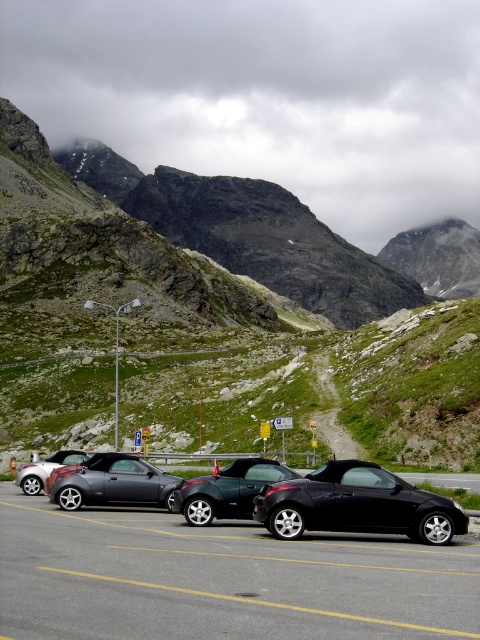
Question: Which is farther from the shiny black convertible at center?

Choices:
 (A) black matte convertible at center
 (B) black glossy car at center
 (C) metallic gray car at center
 (D) metallic gray convertible at center

Answer: (C)

Question: Does metallic gray car at center appear over metallic silver convertible at center?

Choices:
 (A) no
 (B) yes

Answer: (B)

Question: Can you confirm if metallic gray car at center is positioned above rugged granite mountain at upper center?

Choices:
 (A) yes
 (B) no

Answer: (B)

Question: Does black matte convertible at center appear on the right side of green grassy slope at center?

Choices:
 (A) no
 (B) yes

Answer: (A)

Question: Which point appears farthest from the camera in this image?

Choices:
 (A) (383, 500)
 (B) (412, 276)
 (C) (251, 460)

Answer: (B)

Question: Which point appears farthest from the camera in this image?

Choices:
 (A) (94, 461)
 (B) (46, 460)
 (C) (272, 416)

Answer: (C)